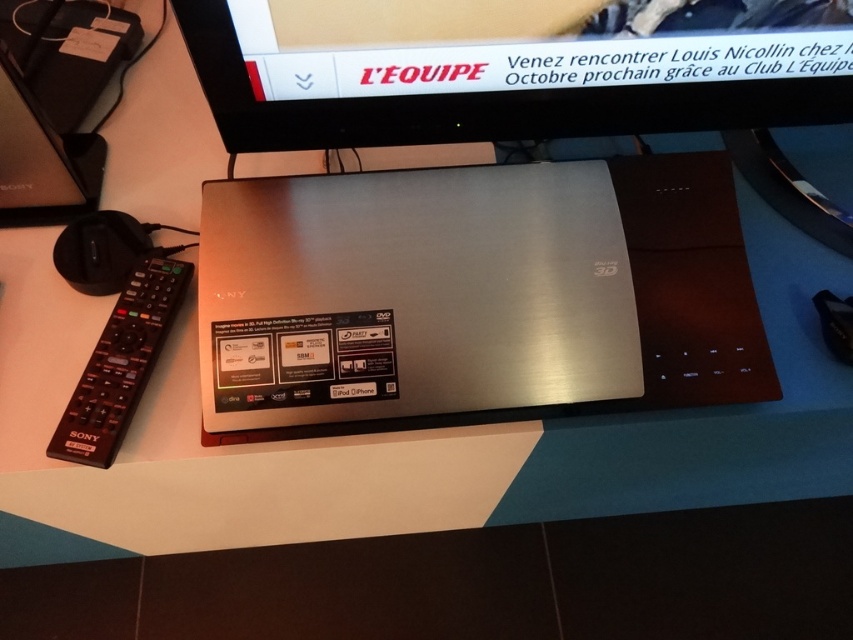
Question: Is satin silver laptop at center above black plastic remote at left?

Choices:
 (A) yes
 (B) no

Answer: (A)

Question: Which of the following is the closest to the observer?

Choices:
 (A) satin silver monitor at upper center
 (B) satin silver laptop at center

Answer: (A)

Question: Does satin silver monitor at upper center lie behind black plastic remote at left?

Choices:
 (A) no
 (B) yes

Answer: (A)

Question: Which is nearer to the satin silver monitor at upper center?

Choices:
 (A) satin silver laptop at center
 (B) black plastic remote at left

Answer: (A)

Question: Can you confirm if satin silver laptop at center is positioned above satin silver monitor at upper center?

Choices:
 (A) yes
 (B) no

Answer: (B)

Question: Among these objects, which one is farthest from the camera?

Choices:
 (A) satin silver monitor at upper center
 (B) satin silver laptop at center

Answer: (B)